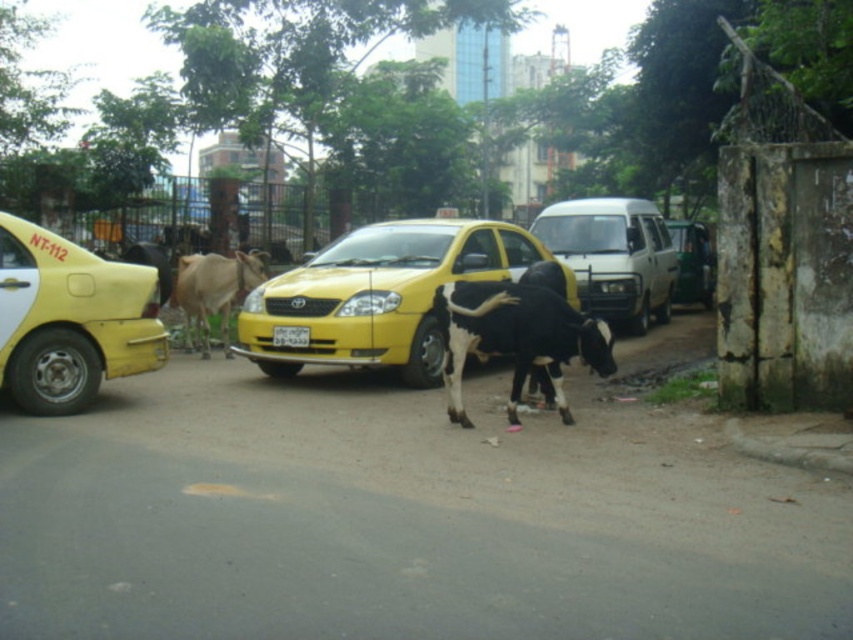
Question: Does yellow matte taxi at left have a larger size compared to metallic silver van at center?

Choices:
 (A) yes
 (B) no

Answer: (B)

Question: Can you confirm if yellow matte taxi at left is smaller than black and white cow at center?

Choices:
 (A) yes
 (B) no

Answer: (B)

Question: Considering the real-world distances, which object is farthest from the brown glossy cow at center?

Choices:
 (A) yellow matte taxi at center
 (B) white plastic license plate at center
 (C) black and white cow at center

Answer: (C)

Question: Which of these objects is positioned closest to the brown glossy cow at center?

Choices:
 (A) yellow matte taxi at left
 (B) white matte van at center
 (C) white plastic license plate at center
 (D) metallic silver van at center

Answer: (C)

Question: Among these points, which one is farthest from the camera?

Choices:
 (A) (297, 344)
 (B) (445, 268)
 (C) (445, 353)
 (D) (202, 342)

Answer: (D)

Question: Does yellow matte taxi at center appear on the right side of yellow matte taxi at left?

Choices:
 (A) yes
 (B) no

Answer: (A)